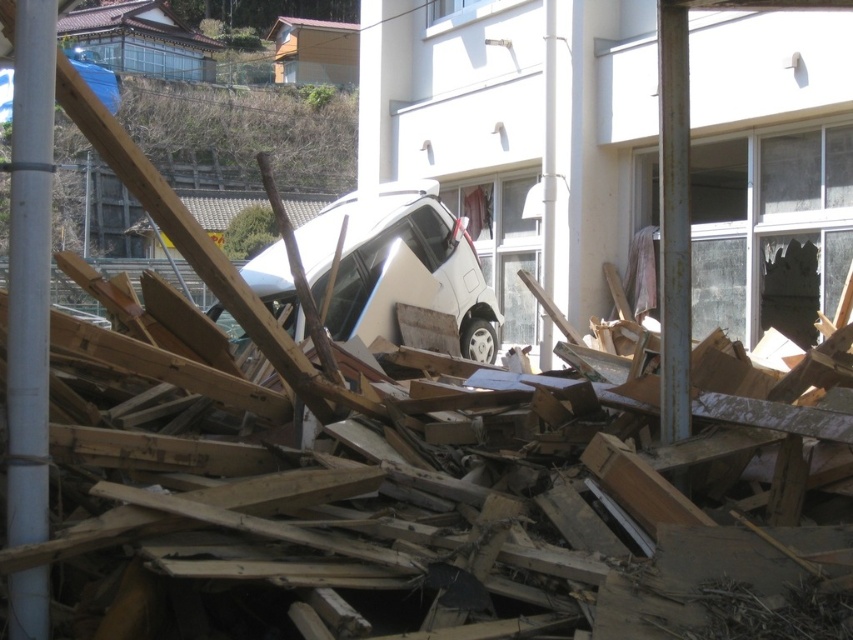
Based on the photo, you are a rescue worker assessing the debris field. You notice the white smooth pipe at center left and the white matte van at center. Which object is narrower in width?

The white smooth pipe at center left has a lesser width compared to the white matte van at center, so it is narrower.

Consider the image. You are a rescue worker assessing the debris field. You notice the white smooth pipe at center left and the white matte van at center. Which object takes up more area in the scene?

The white matte van at center occupies more space than the white smooth pipe at center left, so the van takes up more area in the scene.